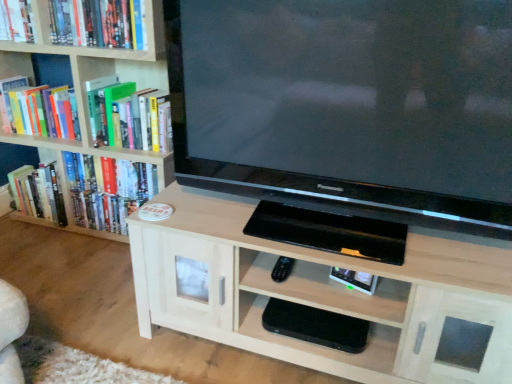
Identify the location of vacant region below black glossy television at center (from a real-world perspective). (327, 233).